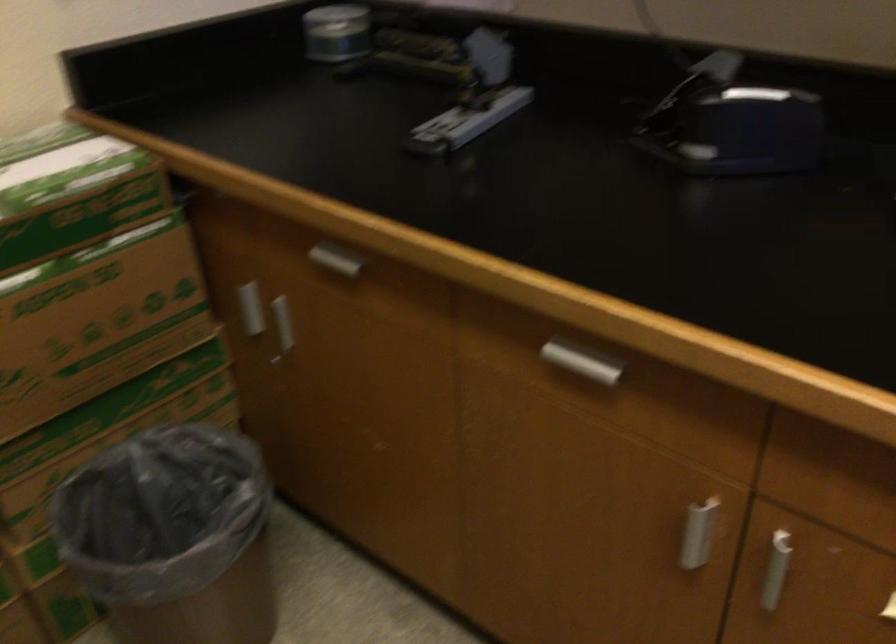
First-person continuous shooting, in which direction is the camera rotating?

The camera rotated toward right-down.